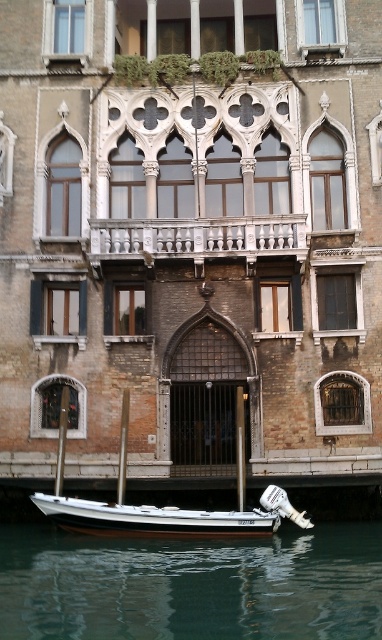
You are a tourist standing on the white stone railing at center and want to take a photo of the greenish water at lower center. In which direction should you point your camera to capture it?

The greenish water at lower center is positioned on the left side of the white stone railing at center, so you should point your camera to the left to capture it.

You are a tourist standing on the white stone railing at center, and you want to throw a small ball to your friend who is in the white polished wood boat at lower center. If the ball can travel 15 meters, will it reach your friend?

The white stone railing at center is 16.45 meters away from the white polished wood boat at lower center. Since the ball can only travel 15 meters, it won